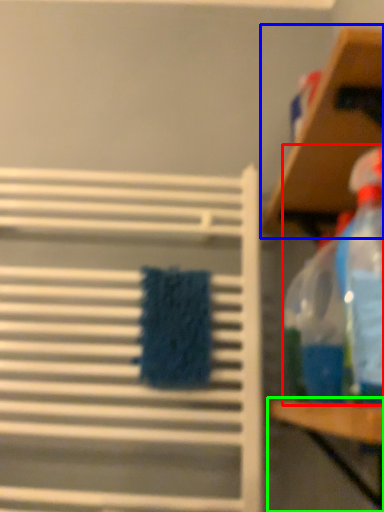
Question: Considering the real-world distances, which object is farthest from cleaning product (highlighted by a red box)? shelf (highlighted by a blue box) or table (highlighted by a green box)?

Choices:
 (A) shelf
 (B) table

Answer: (A)